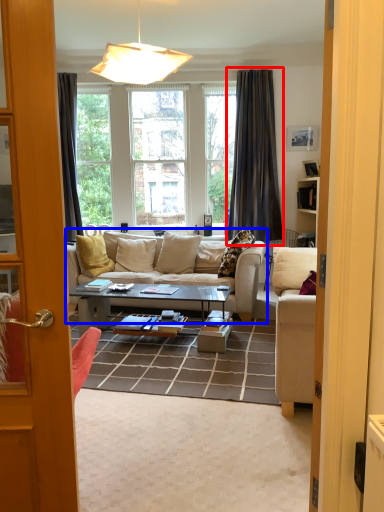
Question: Which object appears closest to the camera in this image, curtain (highlighted by a red box) or studio couch (highlighted by a blue box)?

Choices:
 (A) curtain
 (B) studio couch

Answer: (B)